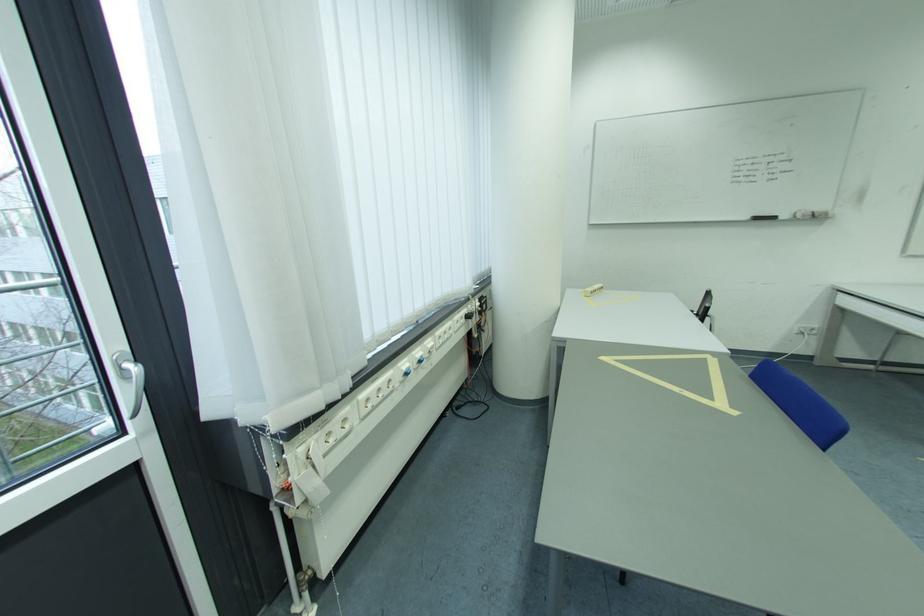
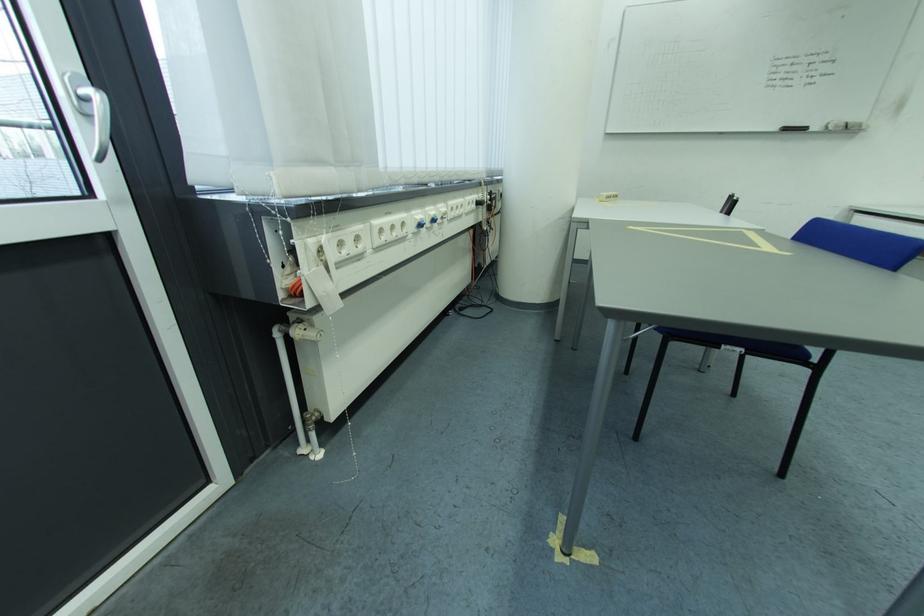
Which direction would the cameraman need to move to produce the second image?

The movement direction of the cameraman is left, forward.